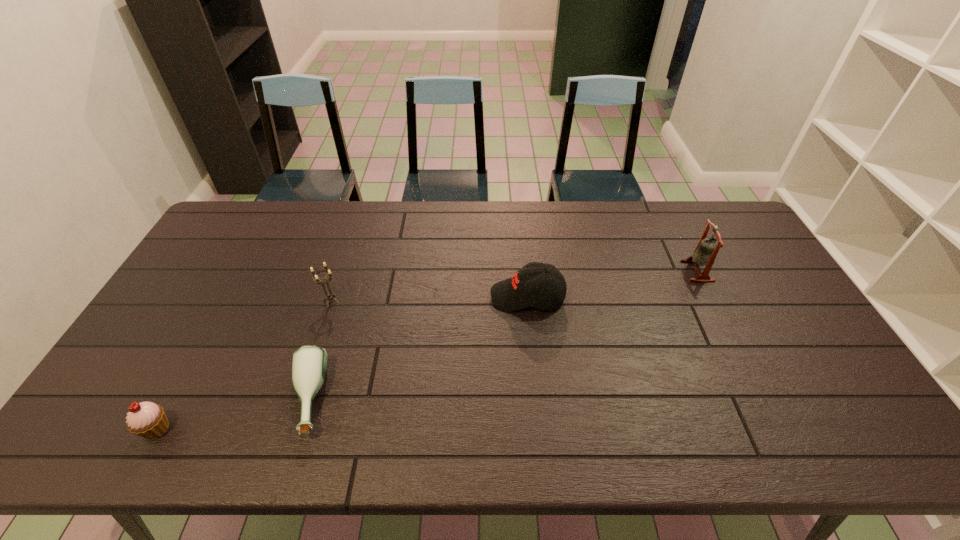
Locate an element on the screen. object that is the second closest one to the candle holder is located at coordinates (146, 419).

Where is `vacant area that satisfies the following two spatial constraints: 1. on the back side of the bottle; 2. on the left side of the leftmost object`? Image resolution: width=960 pixels, height=540 pixels. vacant area that satisfies the following two spatial constraints: 1. on the back side of the bottle; 2. on the left side of the leftmost object is located at coordinates (173, 400).